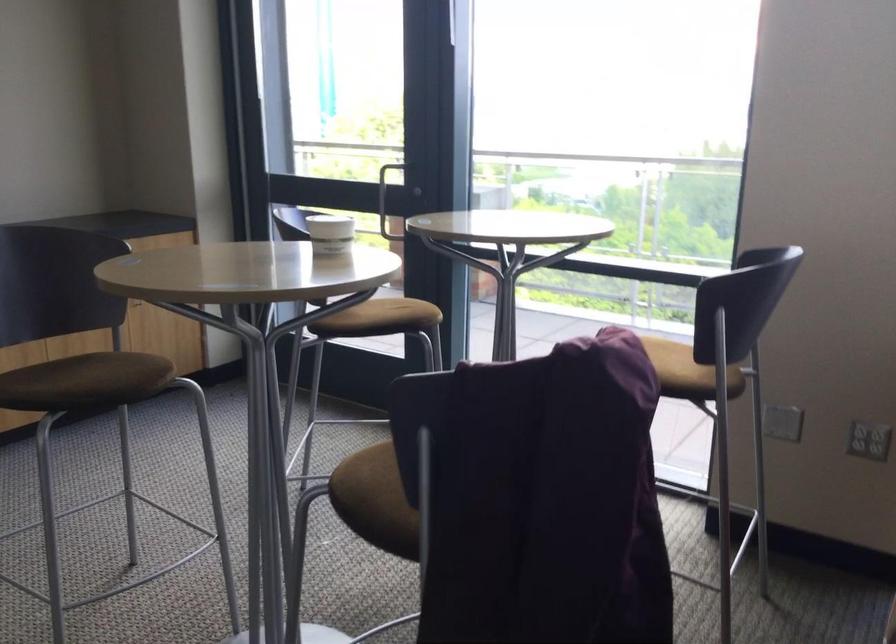
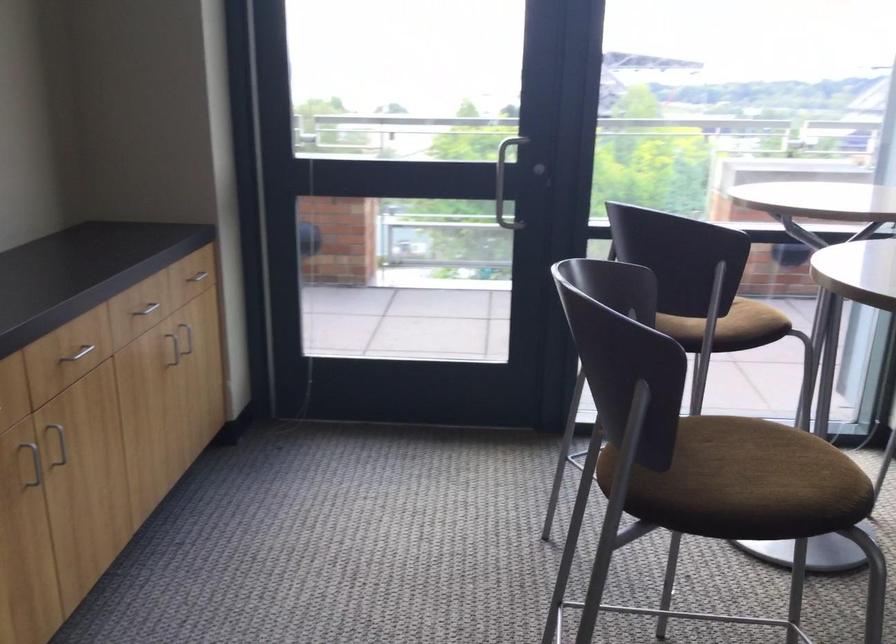
The point at (461, 187) is marked in the first image. Where is the corresponding point in the second image?

(503, 173)